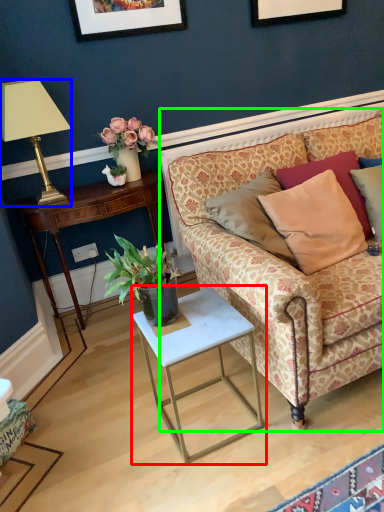
Question: Which object is positioned closest to table (highlighted by a red box)? Select from lamp (highlighted by a blue box) and studio couch (highlighted by a green box).

Choices:
 (A) lamp
 (B) studio couch

Answer: (B)